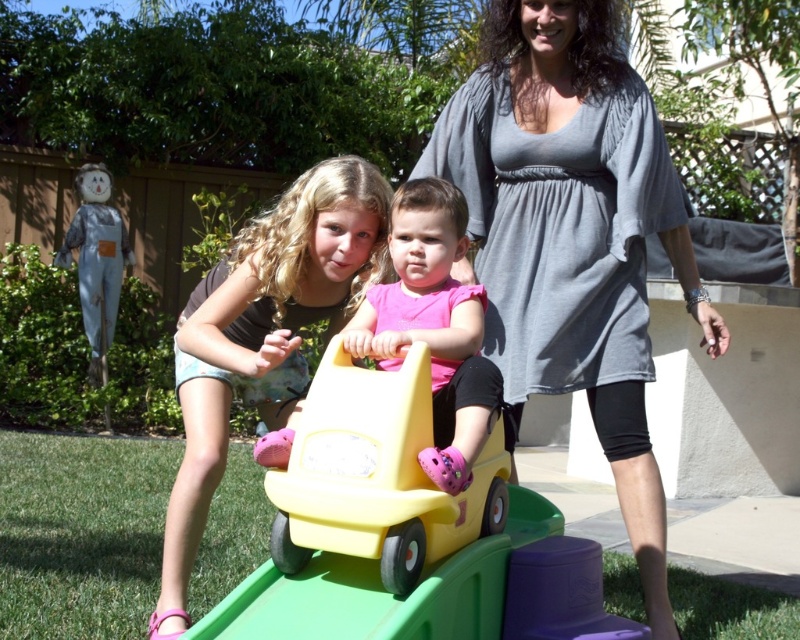
You are a parent in the backyard and see the yellow plastic car at center and the yellow plastic toy car at center. Which one is positioned to the right?

The yellow plastic car at center is to the right of the yellow plastic toy car at center.

You are standing at the point closer to the camera between point [654,538] and point [300,477]. Which point are you standing at?

You are standing at point [654,538] because it is further to the camera than point [300,477].

You are a parent trying to locate your child. You see the gray cotton dress at center and the yellow plastic car at center. Which object is positioned higher relative to the other?

The gray cotton dress at center is above the yellow plastic car at center.